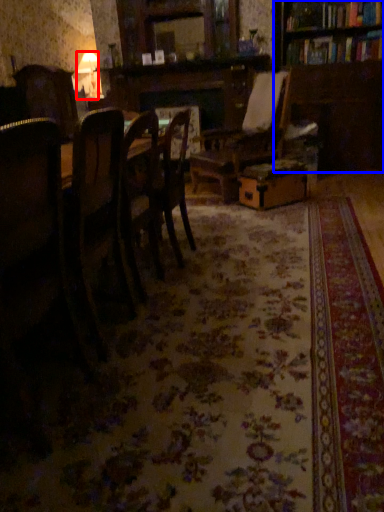
Question: Which object appears farthest to the camera in this image, lamp (highlighted by a red box) or bookcase (highlighted by a blue box)?

Choices:
 (A) lamp
 (B) bookcase

Answer: (A)